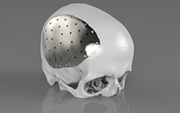
Where is `screws`? screws is located at coordinates coord(91,32), coord(85,24), coord(97,43), coord(85,56), coord(72,17).